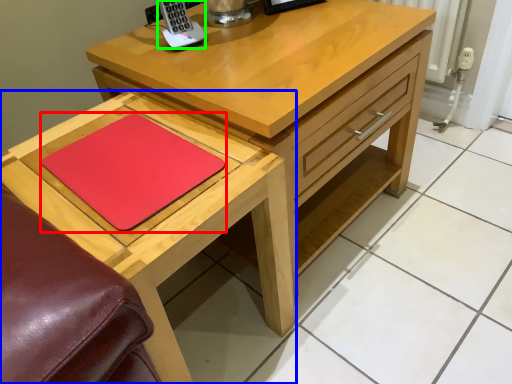
Question: Estimate the real-world distances between objects in this image. Which object is farther from pad (highlighted by a red box), table (highlighted by a blue box) or appliance (highlighted by a green box)?

Choices:
 (A) table
 (B) appliance

Answer: (B)